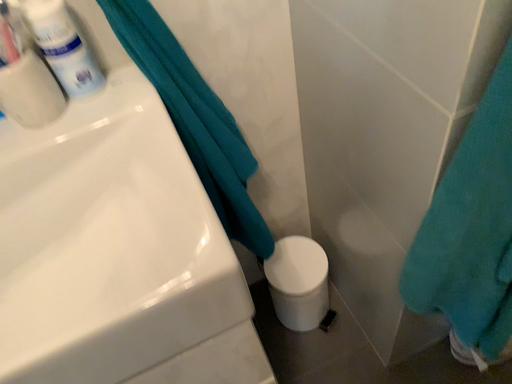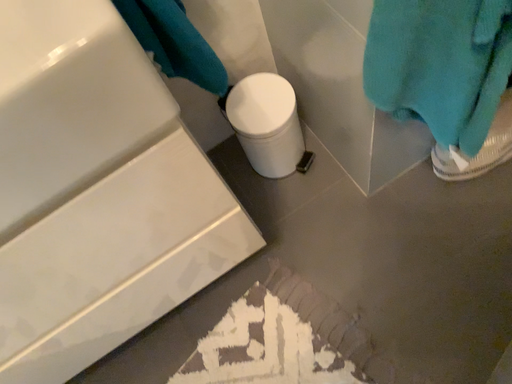
Question: Which way did the camera rotate in the video?

Choices:
 (A) rotated downward
 (B) rotated upward

Answer: (A)